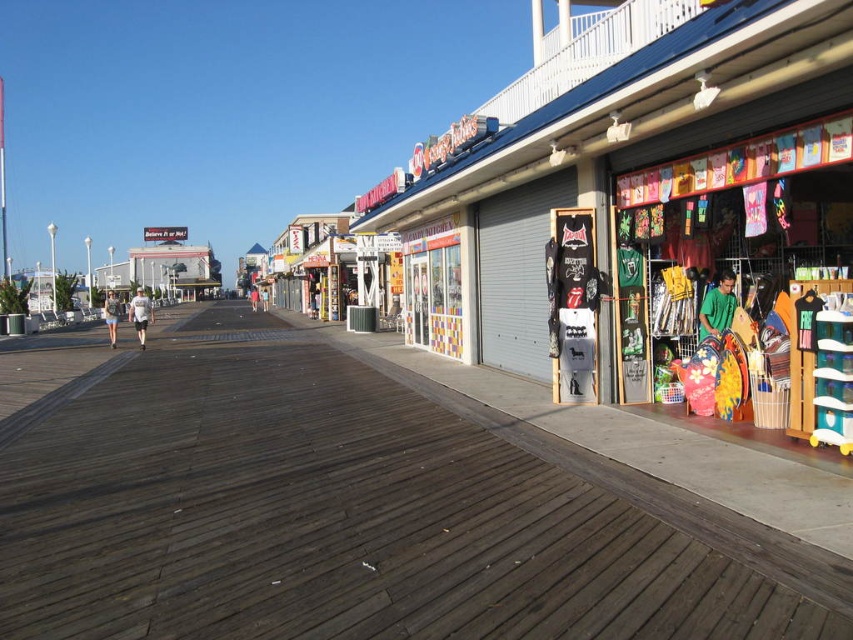
You are standing at the point with coordinates point (x=254, y=305) and want to walk to the point with coordinates point (x=105, y=323). Which direction should you move to reach your destination?

You should move forward because point (x=105, y=323) is in front of point (x=254, y=305).

Based on the photo, you are standing at the camera position looking at the boardwalk. There is a point marked at coordinates point (108, 298). Can you estimate how far this point is from your current position?

The point (108, 298) is 67.03 meters away from the camera position.